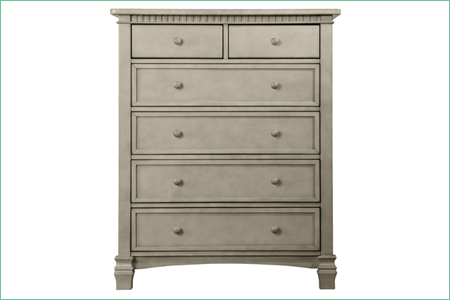
Locate an element on the screen. The image size is (450, 300). this goes in a bedroom is located at coordinates (224, 127).